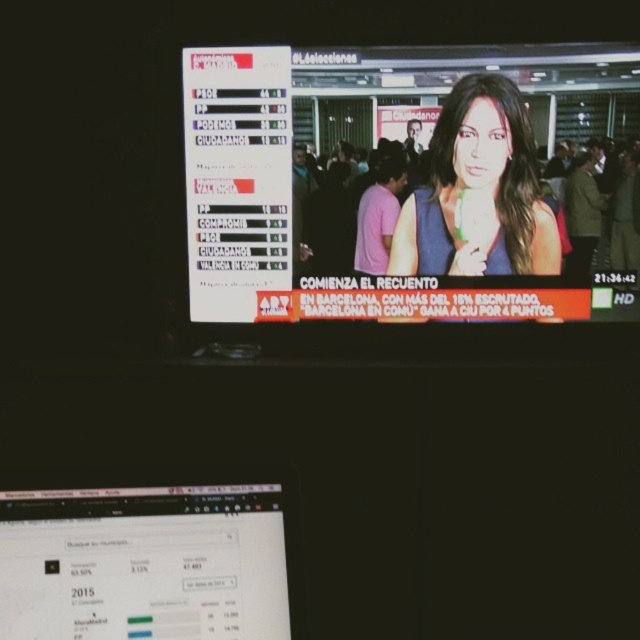
Is matte white scoreboard at upper center closer to the viewer compared to matte black screen at lower center?

No, matte white scoreboard at upper center is further to the viewer.

Between matte white scoreboard at upper center and matte black screen at lower center, which one appears on the right side from the viewer's perspective?

matte white scoreboard at upper center is more to the right.

Does point (500, 220) come in front of point (131, 541)?

No, it is not.

The width and height of the screenshot is (640, 640). In order to click on matte white scoreboard at upper center in this screenshot , I will do `click(372, 200)`.

Is matte white scoreboard at upper center above matte blue dress at center?

Yes.

Does point (244, 172) come closer to viewer compared to point (500, 140)?

No, (244, 172) is behind (500, 140).

The height and width of the screenshot is (640, 640). I want to click on matte white scoreboard at upper center, so click(x=372, y=200).

Measure the distance from matte black screen at lower center to matte blue dress at center.

A distance of 1.06 meters exists between matte black screen at lower center and matte blue dress at center.

Is matte black screen at lower center in front of matte blue dress at center?

Yes, matte black screen at lower center is in front of matte blue dress at center.

Does point (248, 529) lie in front of point (396, 269)?

Yes, it is in front of point (396, 269).

I want to click on matte black screen at lower center, so click(x=150, y=563).